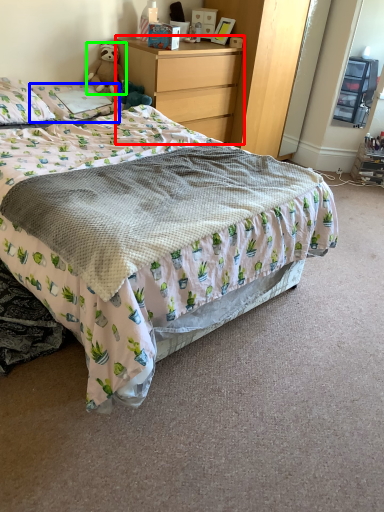
Question: Estimate the real-world distances between objects in this image. Which object is closer to chest of drawers (highlighted by a red box), pillow (highlighted by a blue box) or teddy bear (highlighted by a green box)?

Choices:
 (A) pillow
 (B) teddy bear

Answer: (B)